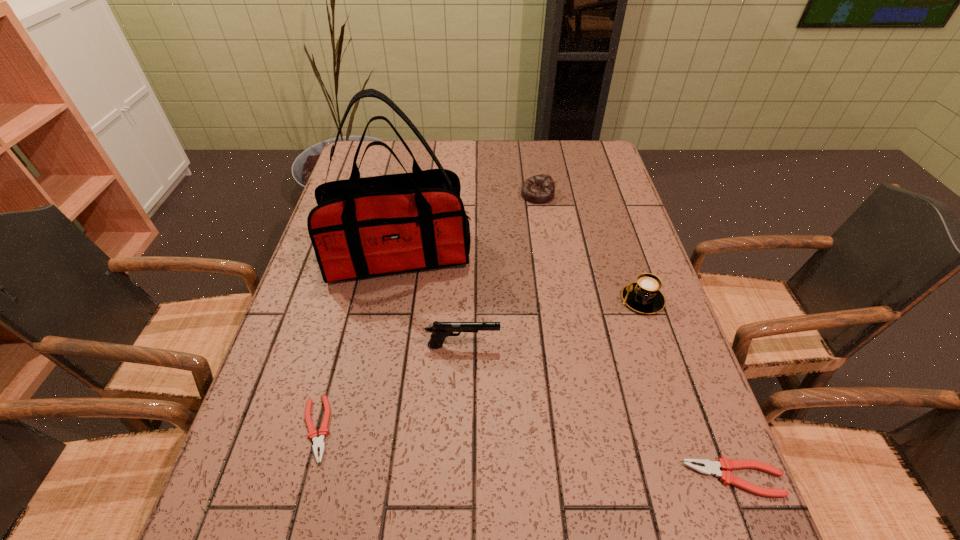
The image size is (960, 540). Find the location of `vacant position in the image that satisfies the following two spatial constraints: 1. at the aiming end of the second tallest object; 2. on the front side of the left pliers`. vacant position in the image that satisfies the following two spatial constraints: 1. at the aiming end of the second tallest object; 2. on the front side of the left pliers is located at coordinates (461, 429).